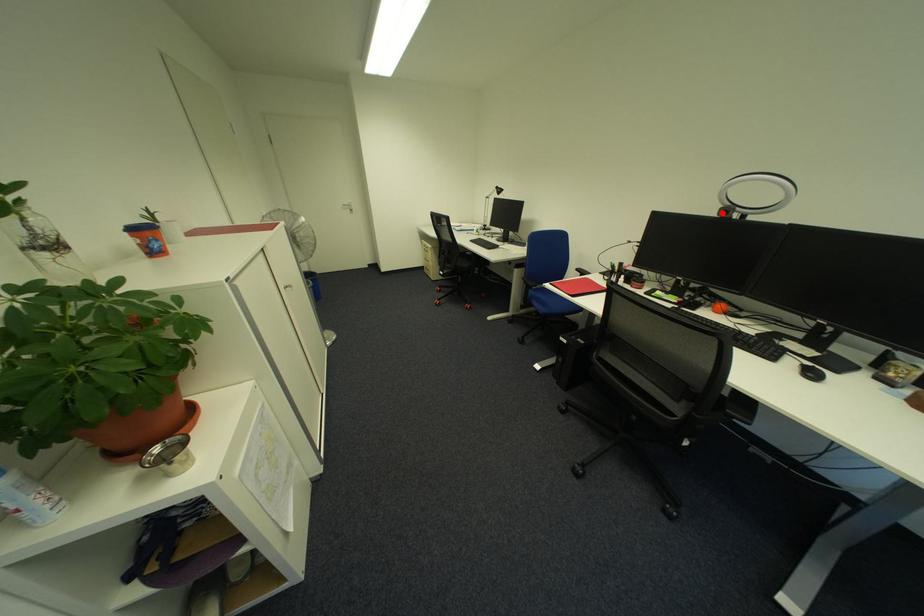
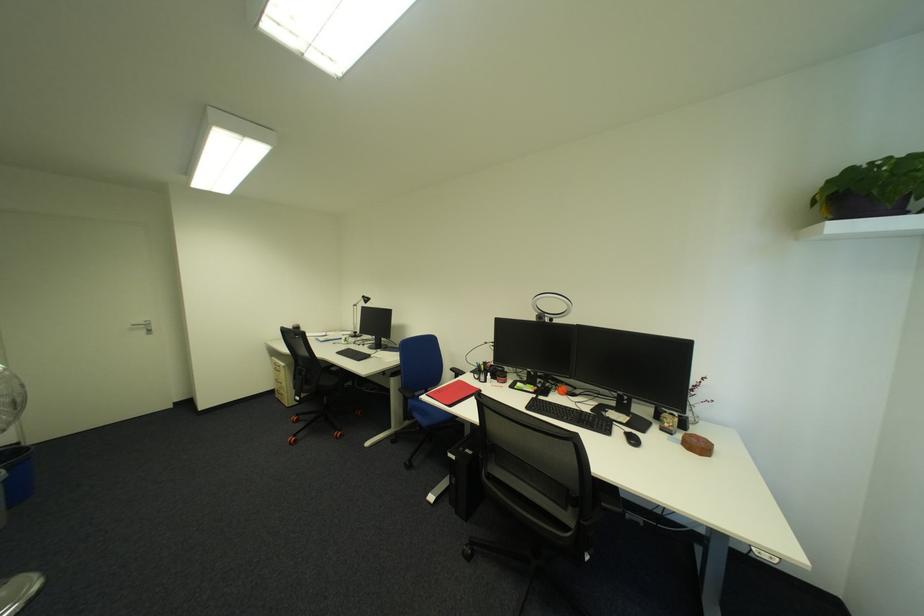
Locate, in the second image, the point that corresponds to the highlighted location in the first image.

(542, 318)